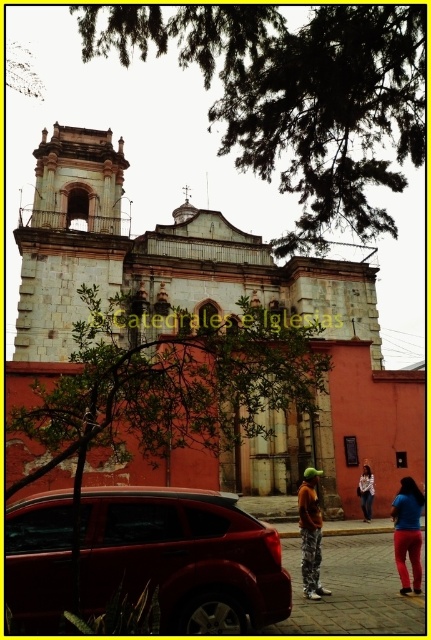
You are standing in front of the historic church and see the green leafy tree at center and the white cotton shirt at center. From your perspective, which object is positioned to the left?

The green leafy tree at center is positioned to the left of the white cotton shirt at center.

You are a photographer planning to take a full body portrait of the person wearing the white cotton shirt at center while ensuring the smooth stone church at center is visible in the background. Based on their heights, will the church be taller than the person in the photo?

The smooth stone church at center has a greater height compared to the white cotton shirt at center, so yes, the church will appear taller than the person in the photo.